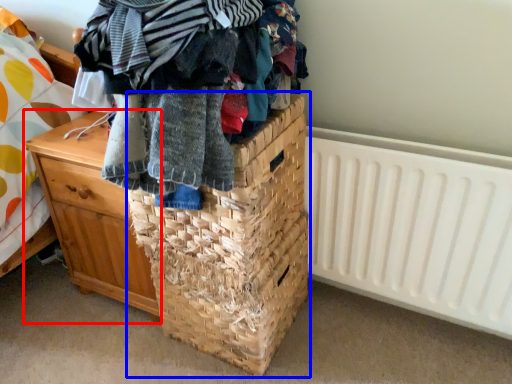
Question: Which point is closer to the camera, chest of drawers (highlighted by a red box) or basket (highlighted by a blue box)?

Choices:
 (A) chest of drawers
 (B) basket

Answer: (B)